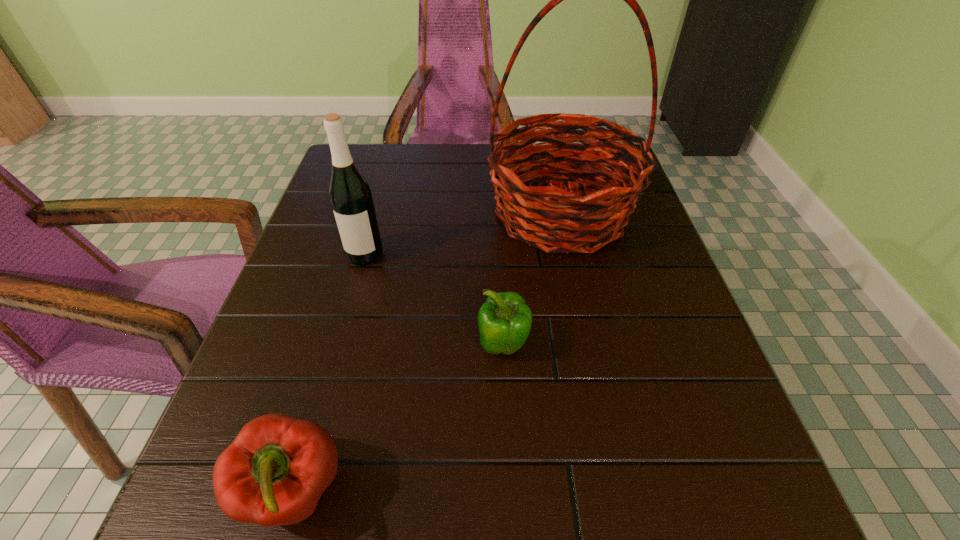
I want to click on basket, so click(x=546, y=218).

Find the location of a particular element. The image size is (960, 540). wine bottle is located at coordinates (351, 199).

You are a GUI agent. You are given a task and a screenshot of the screen. Output one action in this format:
    pyautogui.click(x=<x>, y=<y>)
    Task: Click on the second nearest object
    
    Given the screenshot: What is the action you would take?
    pyautogui.click(x=504, y=320)

I want to click on the right bell pepper, so click(x=504, y=320).

Locate an element on the screen. The height and width of the screenshot is (540, 960). vacant position located 0.160m on the front of the tallest object is located at coordinates (585, 328).

Locate an element on the screen. The image size is (960, 540). vacant region located on the label of the wine bottle is located at coordinates (339, 346).

Identify the location of vacant position located on the left of the third farthest object. (305, 346).

Image resolution: width=960 pixels, height=540 pixels. Find the location of `object at the far edge`. object at the far edge is located at coordinates (546, 218).

At what (x,y) coordinates should I click in order to perform the action: click on object located in the left edge section of the desktop. Please return your answer as a coordinate pair (x, y). Looking at the image, I should click on (351, 199).

Locate an element on the screen. object at the right edge is located at coordinates (546, 218).